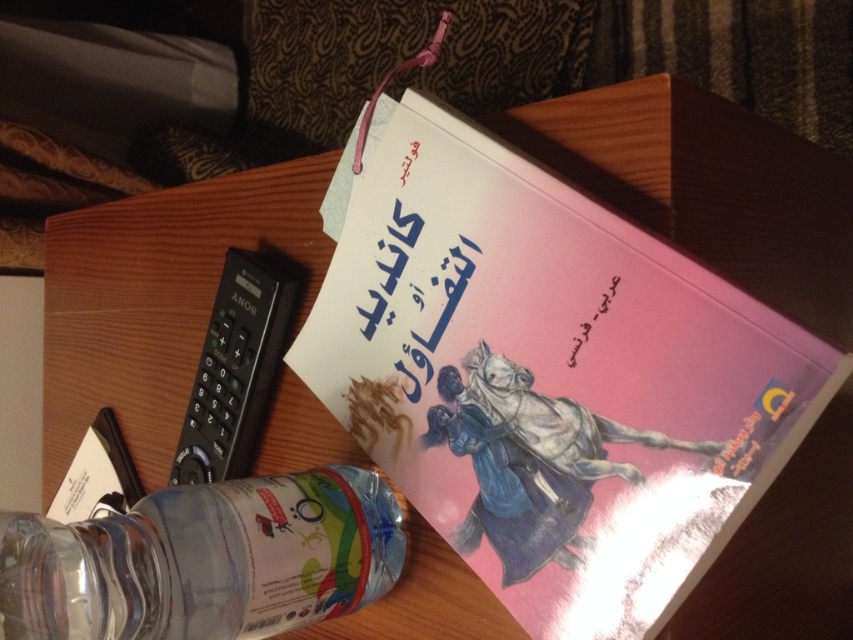
Question: In this image, where is pink matte book at upper center located relative to clear plastic bottle at lower left?

Choices:
 (A) left
 (B) right

Answer: (B)

Question: Which object is closer to the camera taking this photo?

Choices:
 (A) pink matte book at upper center
 (B) pink matte book at center

Answer: (A)

Question: Which of the following is the farthest from the observer?

Choices:
 (A) pink matte book at center
 (B) arabic calligraphy at upper center
 (C) pink matte book at upper center

Answer: (A)

Question: Can you confirm if black plastic remote at left is positioned below arabic calligraphy at upper center?

Choices:
 (A) no
 (B) yes

Answer: (B)

Question: Which point is farther to the camera?

Choices:
 (A) pink matte book at center
 (B) clear plastic bottle at lower left
 (C) black plastic remote at left

Answer: (C)

Question: Does black plastic remote at left appear on the right side of arabic calligraphy at upper center?

Choices:
 (A) yes
 (B) no

Answer: (B)